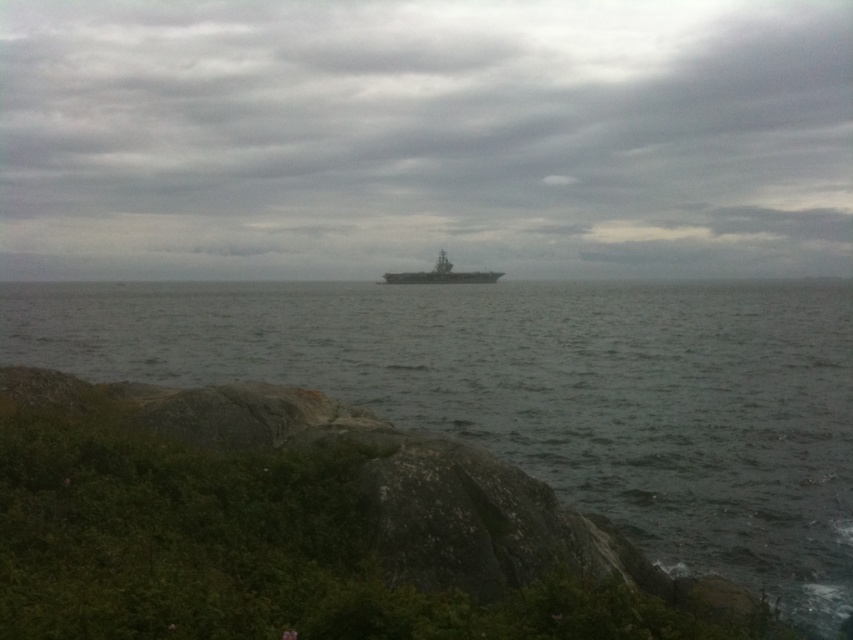
Question: Is the position of gray matte water at center more distant than that of dark gray metallic aircraft carrier at center?

Choices:
 (A) no
 (B) yes

Answer: (A)

Question: Does gray matte water at center appear on the left side of dark gray metallic aircraft carrier at center?

Choices:
 (A) yes
 (B) no

Answer: (A)

Question: Does gray matte water at center appear under dark gray metallic aircraft carrier at center?

Choices:
 (A) no
 (B) yes

Answer: (B)

Question: Which point is farther to the camera?

Choices:
 (A) dark gray metallic aircraft carrier at center
 (B) gray matte water at center

Answer: (A)